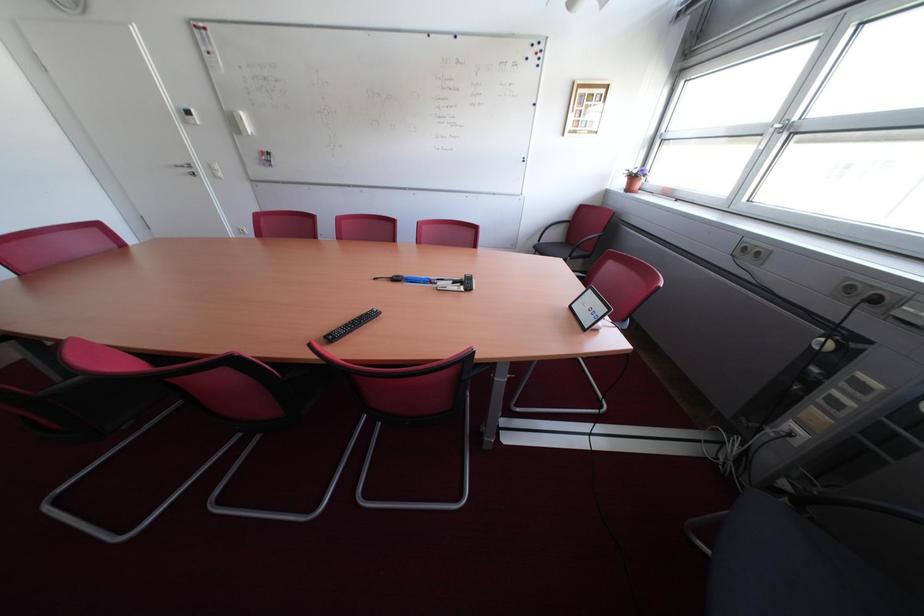
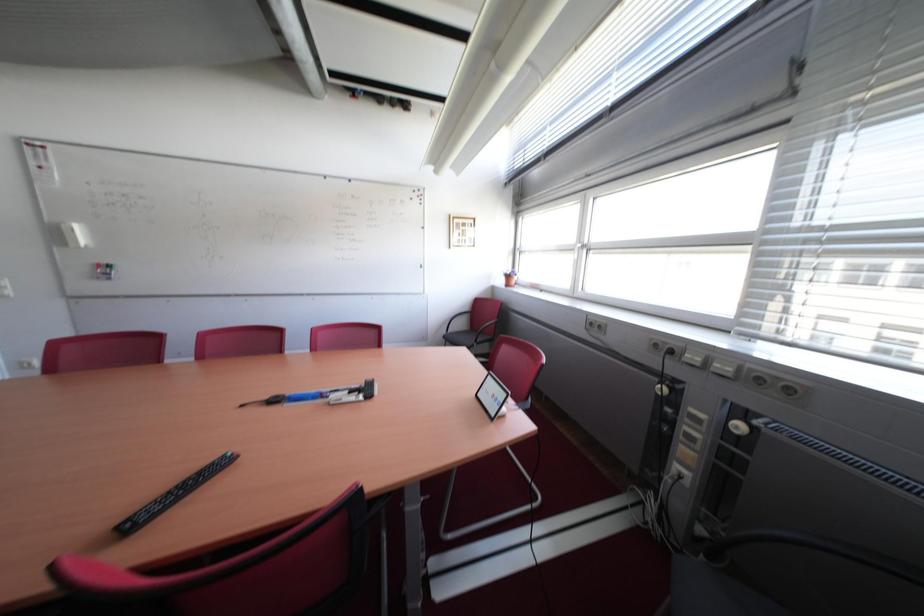
The images are taken continuously from a first-person perspective. In which direction is your viewpoint rotating?

The camera rotated toward right-up.